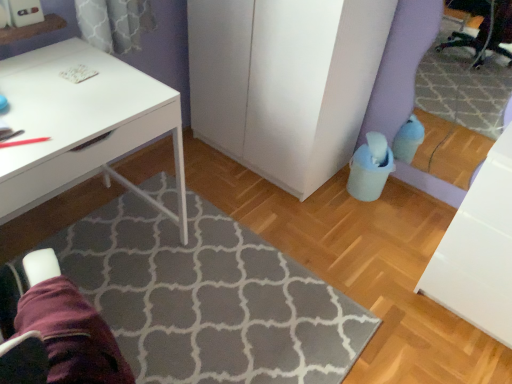
Question: Is white matte desk at upper left oriented towards gray textured rug at center?

Choices:
 (A) no
 (B) yes

Answer: (B)

Question: Is gray textured rug at center surrounded by white matte desk at upper left?

Choices:
 (A) no
 (B) yes

Answer: (A)

Question: From a real-world perspective, does white matte desk at upper left stand above gray textured rug at center?

Choices:
 (A) no
 (B) yes

Answer: (B)

Question: Is white matte desk at upper left at the left side of gray textured rug at center?

Choices:
 (A) no
 (B) yes

Answer: (B)

Question: Is white matte desk at upper left directly adjacent to gray textured rug at center?

Choices:
 (A) yes
 (B) no

Answer: (B)

Question: In terms of size, does white matte cabinet at center appear bigger or smaller than gray textured rug at center?

Choices:
 (A) big
 (B) small

Answer: (A)

Question: Is white matte cabinet at center inside the boundaries of gray textured rug at center, or outside?

Choices:
 (A) outside
 (B) inside

Answer: (A)

Question: Does point (222, 109) appear closer or farther from the camera than point (197, 365)?

Choices:
 (A) farther
 (B) closer

Answer: (A)

Question: From a real-world perspective, relative to gray textured rug at center, is white matte cabinet at center vertically above or below?

Choices:
 (A) above
 (B) below

Answer: (A)

Question: In terms of height, does white matte desk at upper left look taller or shorter compared to purple fabric swivel chair at lower left?

Choices:
 (A) short
 (B) tall

Answer: (B)

Question: Do you think white matte desk at upper left is within purple fabric swivel chair at lower left, or outside of it?

Choices:
 (A) outside
 (B) inside

Answer: (A)

Question: Would you say white matte desk at upper left is to the left or to the right of purple fabric swivel chair at lower left in the picture?

Choices:
 (A) right
 (B) left

Answer: (B)

Question: In terms of size, does white matte desk at upper left appear bigger or smaller than purple fabric swivel chair at lower left?

Choices:
 (A) big
 (B) small

Answer: (A)

Question: In terms of size, does gray textured rug at center appear bigger or smaller than white matte desk at upper left?

Choices:
 (A) small
 (B) big

Answer: (A)

Question: From a real-world perspective, is gray textured rug at center positioned above or below white matte desk at upper left?

Choices:
 (A) above
 (B) below

Answer: (B)